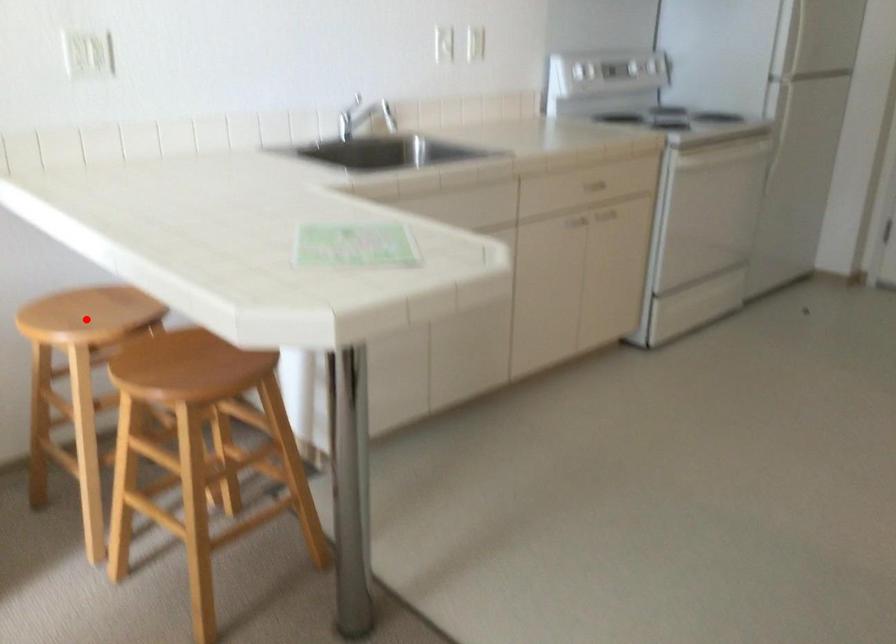
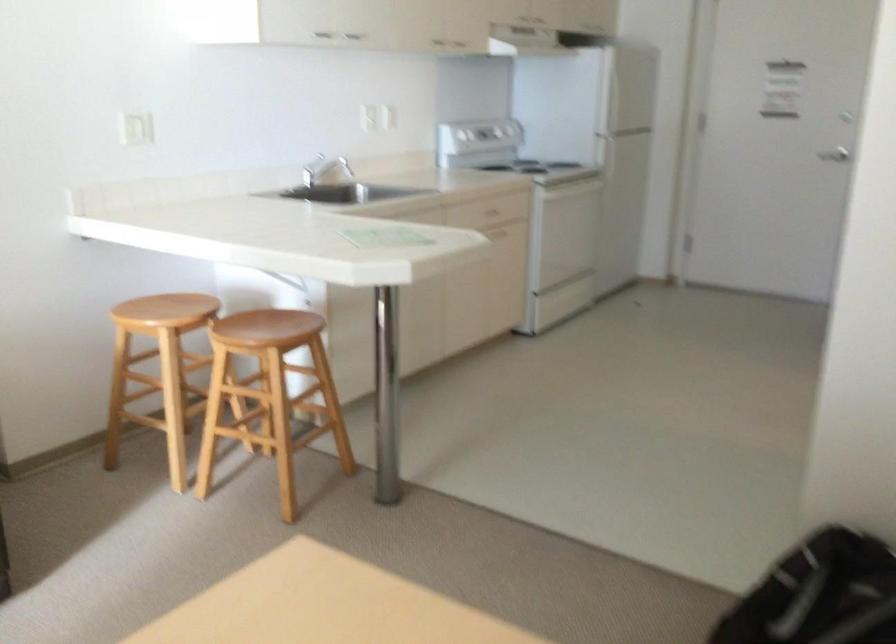
Question: I am providing you with two images of the same scene from different viewpoints. In image1, a red point is highlighted. Considering the same 3D point in image2, which of the following is correct?

Choices:
 (A) It is closer
 (B) It is farther

Answer: (B)